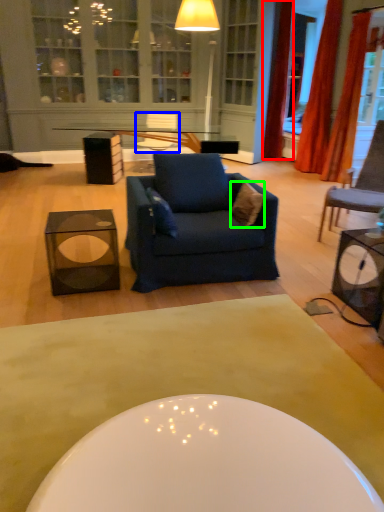
Question: Considering the real-world distances, which object is farthest from curtain (highlighted by a red box)? armchair (highlighted by a blue box) or pillow (highlighted by a green box)?

Choices:
 (A) armchair
 (B) pillow

Answer: (B)